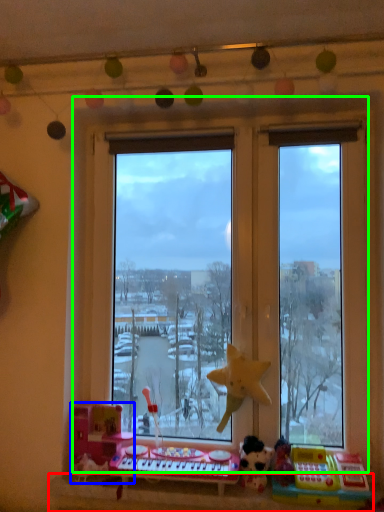
Question: Which object is the closest to the window sill (highlighted by a red box)? Choose among these: toy (highlighted by a blue box) or window (highlighted by a green box).

Choices:
 (A) toy
 (B) window

Answer: (A)